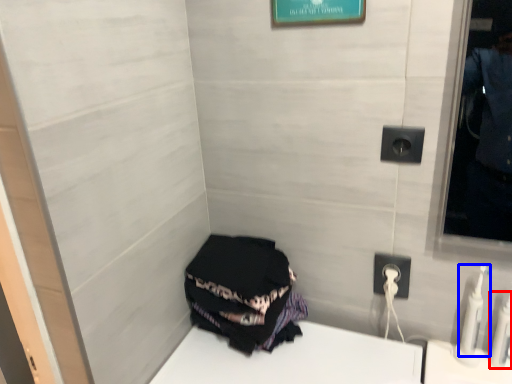
Question: Which object appears closest to the camera in this image, toiletry (highlighted by a red box) or toiletry (highlighted by a blue box)?

Choices:
 (A) toiletry
 (B) toiletry

Answer: (A)